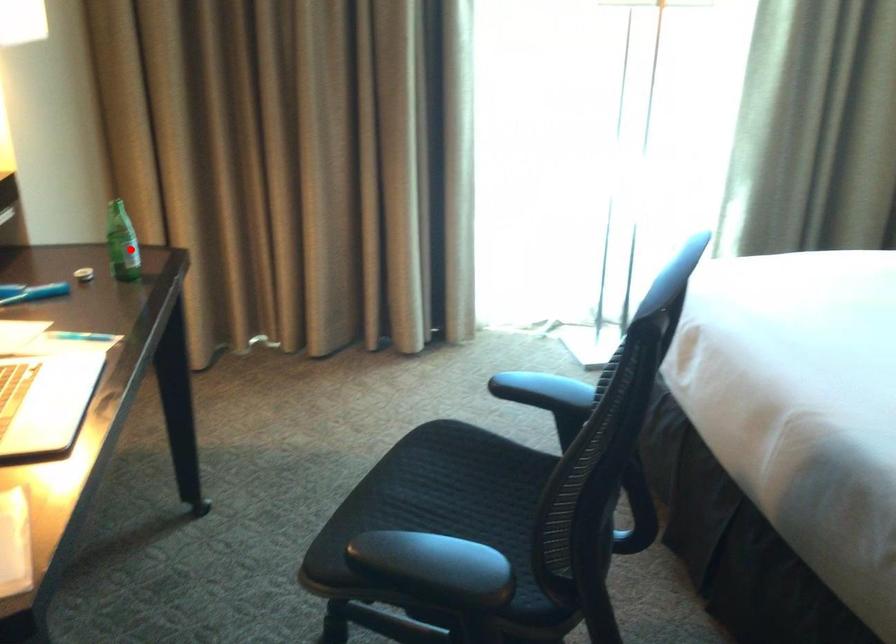
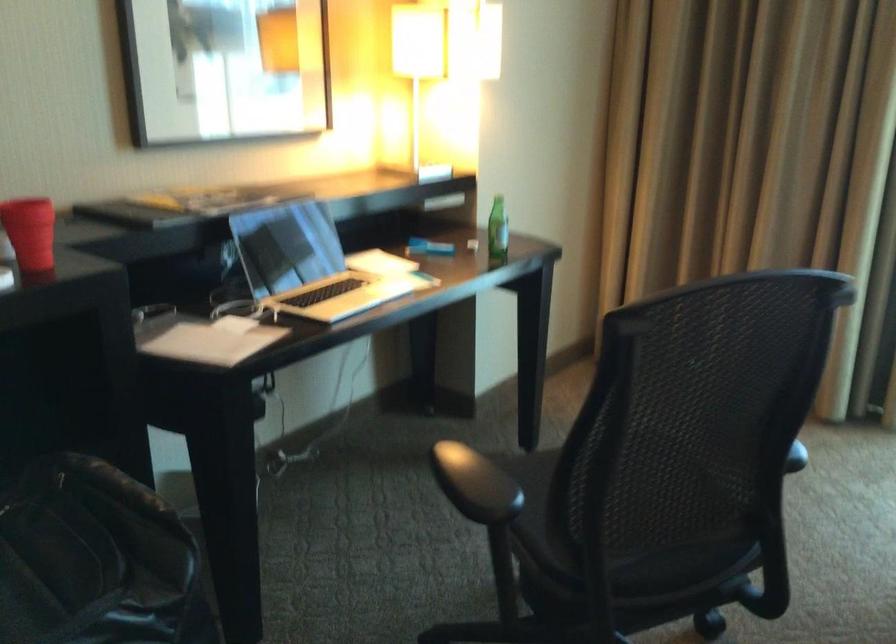
The point at the highlighted location is marked in the first image. Where is the corresponding point in the second image?

(497, 229)